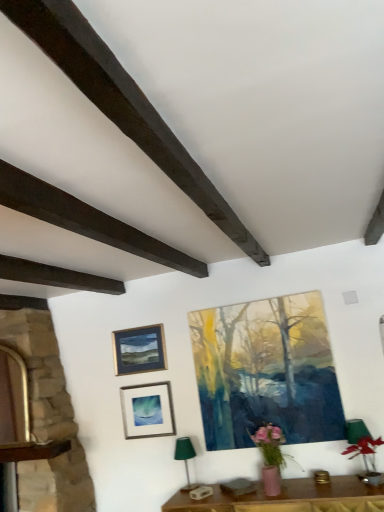
Question: Does dark brown wood at upper left, which is the 2th plank in right-to-left order, come behind green fabric lampshade at lower center?

Choices:
 (A) no
 (B) yes

Answer: (A)

Question: Is the depth of dark brown wood at upper left, which is the first plank in left-to-right order, less than that of green fabric lampshade at lower center?

Choices:
 (A) no
 (B) yes

Answer: (B)

Question: Is green fabric lampshade at lower center a part of dark brown wood at upper left, which is the 2th plank in right-to-left order?

Choices:
 (A) yes
 (B) no

Answer: (B)

Question: Is dark brown wood at upper left, which is the first plank in left-to-right order, oriented away from green fabric lampshade at lower center?

Choices:
 (A) no
 (B) yes

Answer: (A)

Question: Is dark brown wood at upper left, which is the first plank in left-to-right order, to the left of green fabric lampshade at lower center from the viewer's perspective?

Choices:
 (A) yes
 (B) no

Answer: (A)

Question: Considering the positions of dark brown wood at upper left, which is the first plank in left-to-right order, and matte acrylic painting at center, the third picture frame in the left-to-right sequence, in the image, is dark brown wood at upper left, which is the first plank in left-to-right order, wider or thinner than matte acrylic painting at center, the third picture frame in the left-to-right sequence,?

Choices:
 (A) wide
 (B) thin

Answer: (A)

Question: Visually, is dark brown wood at upper left, which is the first plank in left-to-right order, positioned to the left or to the right of matte acrylic painting at center, the third picture frame in the left-to-right sequence?

Choices:
 (A) left
 (B) right

Answer: (A)

Question: Does point (87, 210) appear closer or farther from the camera than point (301, 410)?

Choices:
 (A) farther
 (B) closer

Answer: (B)

Question: In the image, is dark brown wood at upper left, which is the first plank in left-to-right order, positioned in front of or behind matte acrylic painting at center, the first picture frame from the right?

Choices:
 (A) behind
 (B) front

Answer: (B)

Question: Considering the positions of matte acrylic painting at center, the first picture frame from the right, and dark brown wood at upper left, which is the 2th plank in right-to-left order, in the image, is matte acrylic painting at center, the first picture frame from the right, wider or thinner than dark brown wood at upper left, which is the 2th plank in right-to-left order,?

Choices:
 (A) wide
 (B) thin

Answer: (B)

Question: From a real-world perspective, is matte acrylic painting at center, the first picture frame from the right, above or below dark brown wood at upper left, which is the 2th plank in right-to-left order?

Choices:
 (A) above
 (B) below

Answer: (B)

Question: From their relative heights in the image, would you say matte acrylic painting at center, the first picture frame from the right, is taller or shorter than dark brown wood at upper left, which is the first plank in left-to-right order?

Choices:
 (A) short
 (B) tall

Answer: (B)

Question: Would you say matte acrylic painting at center, the third picture frame in the left-to-right sequence, is to the left or to the right of dark brown wood at upper left, which is the 2th plank in right-to-left order, in the picture?

Choices:
 (A) left
 (B) right

Answer: (B)

Question: Considering the positions of point (99, 37) and point (59, 479), is point (99, 37) closer or farther from the camera than point (59, 479)?

Choices:
 (A) closer
 (B) farther

Answer: (A)

Question: Considering the positions of dark brown wood at upper left, which is the first plank in right-to-left order, and stone fireplace at left in the image, is dark brown wood at upper left, which is the first plank in right-to-left order, taller or shorter than stone fireplace at left?

Choices:
 (A) tall
 (B) short

Answer: (B)